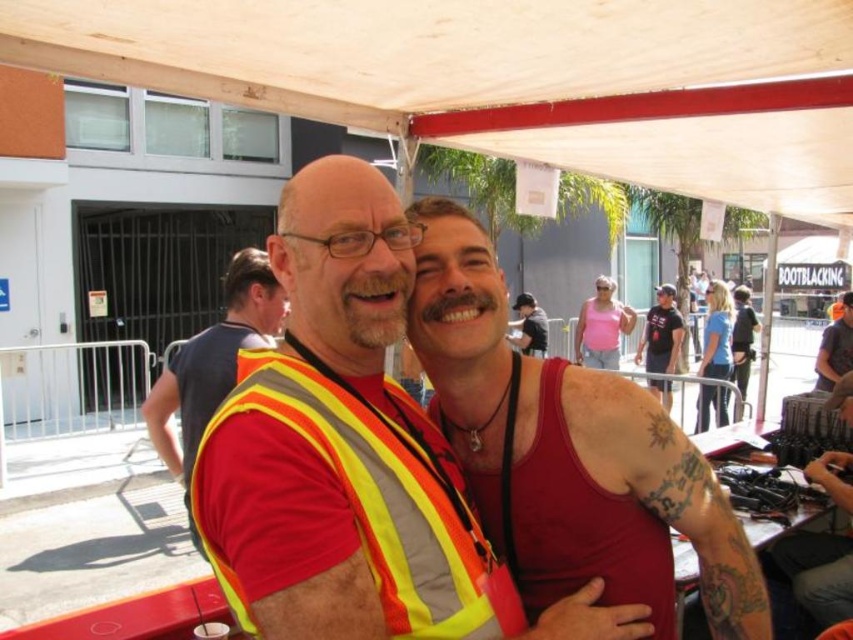
You are at a festival under a white canopy with red poles. You see a reflective yellow safety vest at center and a matte black tank top at center. Which clothing item is closer to you?

The reflective yellow safety vest at center is closer to you because it is in front of the matte black tank top at center.

You are standing at the entrance of the event and see two people at the center wearing a red tank top at center and a matte black tank top at center. Which one is closer to you?

The red tank top at center is closer to the viewer than the matte black tank top at center, so the red tank top at center is closer to you.